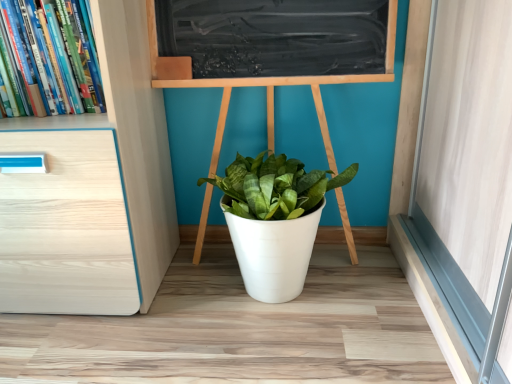
Question: Is white matte pot at center wider or thinner than hardcover books at left?

Choices:
 (A) wide
 (B) thin

Answer: (A)

Question: Choose the correct answer: Is white matte pot at center inside hardcover books at left or outside it?

Choices:
 (A) outside
 (B) inside

Answer: (A)

Question: Relative to hardcover books at left, is white matte pot at center in front or behind?

Choices:
 (A) front
 (B) behind

Answer: (B)

Question: Is hardcover books at left inside or outside of white matte pot at center?

Choices:
 (A) outside
 (B) inside

Answer: (A)

Question: From a real-world perspective, is hardcover books at left physically located above or below white matte pot at center?

Choices:
 (A) below
 (B) above

Answer: (B)

Question: Is hardcover books at left wider or thinner than white matte pot at center?

Choices:
 (A) thin
 (B) wide

Answer: (A)

Question: Relative to white matte pot at center, is hardcover books at left in front or behind?

Choices:
 (A) behind
 (B) front

Answer: (B)